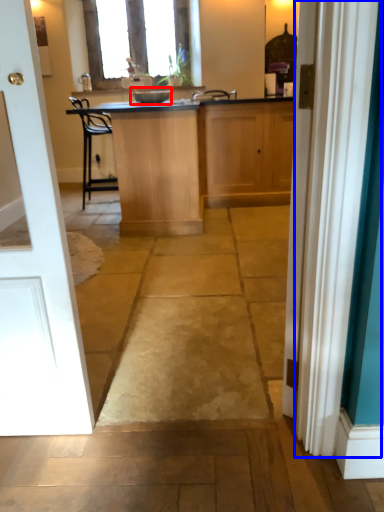
Question: Which point is further to the camera, appliance (highlighted by a red box) or curtain (highlighted by a blue box)?

Choices:
 (A) appliance
 (B) curtain

Answer: (A)